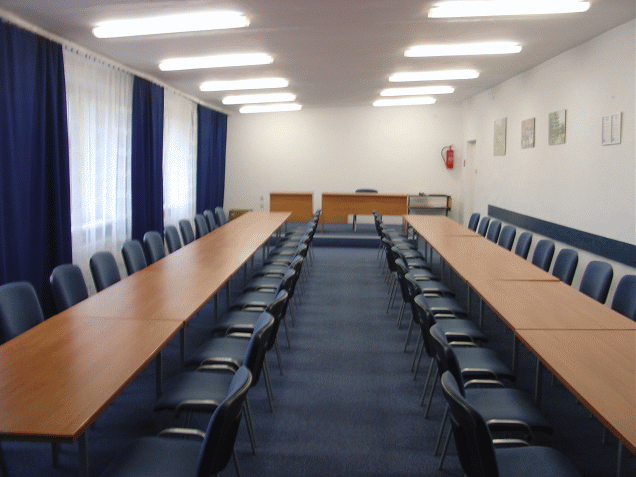
The image size is (636, 477). What are the coordinates of `fire extinguisher` in the screenshot? It's located at (453, 161).